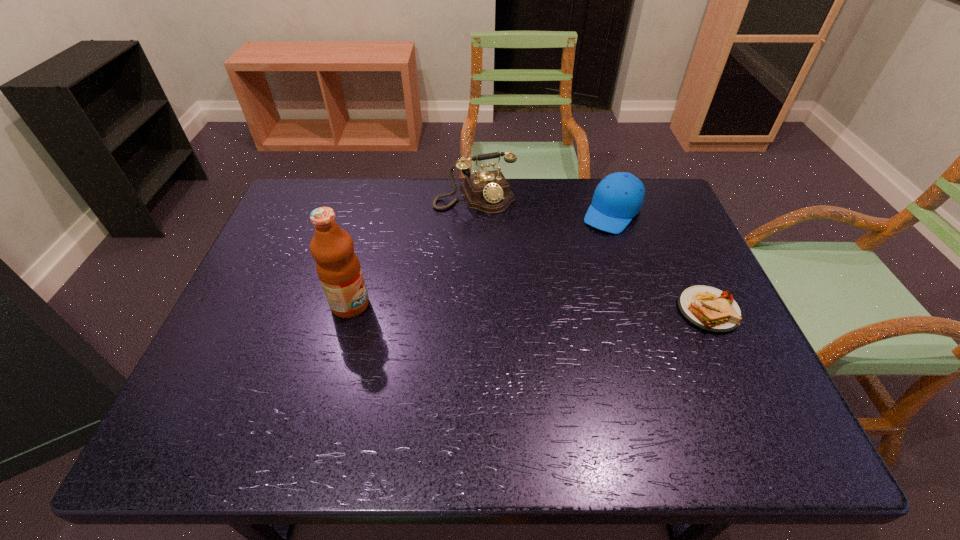
This screenshot has height=540, width=960. I want to click on vacant space at the near edge of the desktop, so click(x=561, y=399).

Identify the location of free space at the left edge of the desktop. The width and height of the screenshot is (960, 540). (285, 230).

Locate an element on the screen. vacant space at the far left corner of the desktop is located at coordinates (300, 224).

You are a GUI agent. You are given a task and a screenshot of the screen. Output one action in this format:
    pyautogui.click(x=<x>, y=<y>)
    Task: Click on the vacant space at the near left corner
    
    Given the screenshot: What is the action you would take?
    pyautogui.click(x=199, y=402)

I want to click on free spot at the far right corner of the desktop, so click(x=634, y=220).

This screenshot has width=960, height=540. Find the location of `unoccupied area between the cap and the sandwich`. unoccupied area between the cap and the sandwich is located at coordinates (660, 261).

In order to click on free spot between the telephone and the second shortest object in this screenshot , I will do `click(543, 204)`.

What are the coordinates of `empty space between the shortest object and the second tallest object` in the screenshot? It's located at (591, 253).

Locate an element on the screen. The height and width of the screenshot is (540, 960). free area in between the shortest object and the second shortest object is located at coordinates (660, 261).

Image resolution: width=960 pixels, height=540 pixels. I want to click on unoccupied area between the leftmost object and the third tallest object, so click(481, 258).